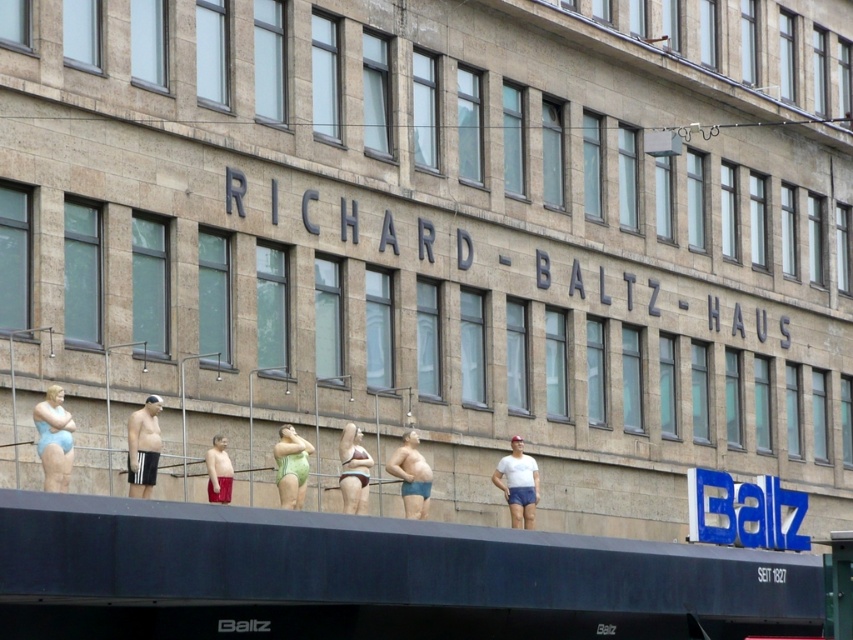
Based on the photo, is black adidas shorts at left positioned at the back of matte green swimsuit at center?

No.

In the scene shown: Is black adidas shorts at left in front of matte green swimsuit at center?

Yes, black adidas shorts at left is closer to the viewer.

Image resolution: width=853 pixels, height=640 pixels. I want to click on black adidas shorts at left, so click(143, 448).

Who is positioned more to the right, matte blue shorts at center or green matte swimsuit at center?

matte blue shorts at center is more to the right.

Identify the location of matte blue shorts at center. This screenshot has width=853, height=640. (410, 476).

Which of these two, matte blue swimsuit at left or black adidas shorts at left, stands taller?

With more height is black adidas shorts at left.

Is matte blue swimsuit at left taller than black adidas shorts at left?

No, matte blue swimsuit at left is not taller than black adidas shorts at left.

Is point (51, 428) in front of point (142, 412)?

Yes, it is in front of point (142, 412).

At what (x,y) coordinates should I click in order to perform the action: click on matte blue swimsuit at left. Please return your answer as a coordinate pair (x, y). Image resolution: width=853 pixels, height=640 pixels. Looking at the image, I should click on (54, 440).